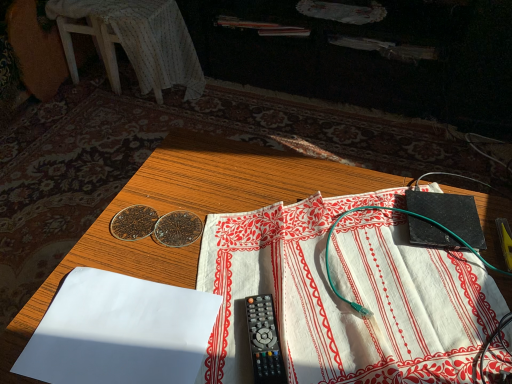
The width and height of the screenshot is (512, 384). I want to click on free space behind white paper at lower left, which appears as the 1th sheet when viewed from the left, so click(x=161, y=237).